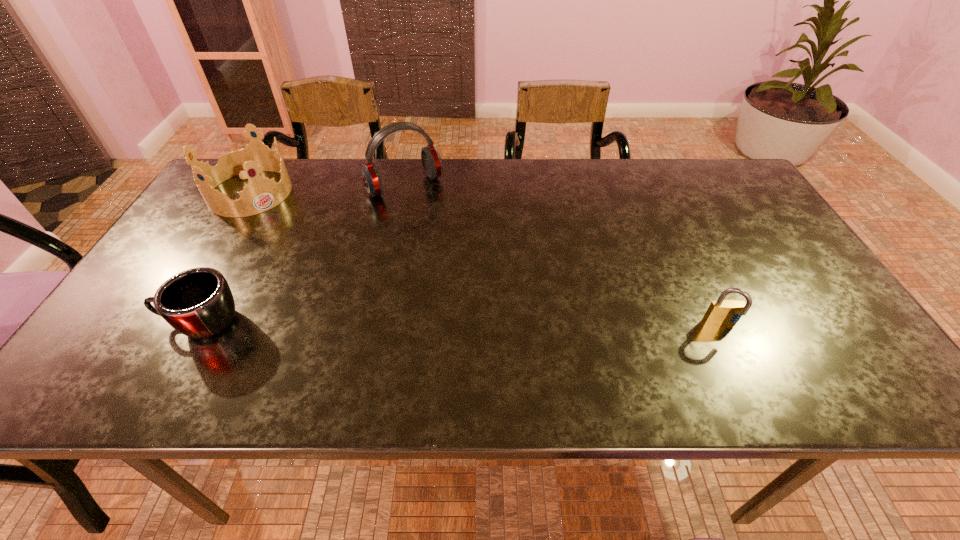
In order to click on free space between the mug and the padlock in this screenshot , I will do `click(461, 324)`.

Find the location of a particular element. The image size is (960, 540). free space between the tiara and the padlock is located at coordinates pos(486,259).

I want to click on blank region between the mug and the second object from right to left, so click(x=302, y=254).

Image resolution: width=960 pixels, height=540 pixels. Identify the location of object that can be found as the second closest to the rightmost object. [198, 302].

I want to click on object that is the second closest to the rightmost object, so (198, 302).